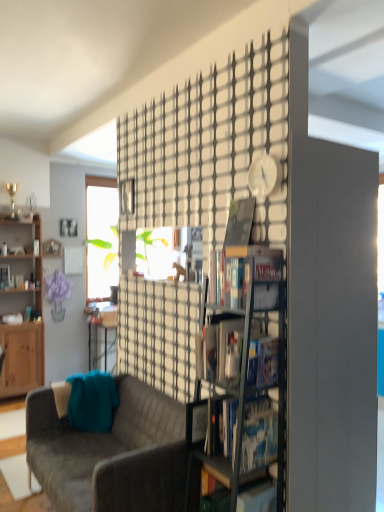
This screenshot has height=512, width=384. Describe the element at coordinates (111, 453) in the screenshot. I see `velvet gray couch at lower left` at that location.

Identify the location of matte black magazine at center. Image resolution: width=384 pixels, height=512 pixels. (192, 251).

This screenshot has width=384, height=512. In order to click on hardcover book at center, the 6th book from the left in this screenshot , I will do [239, 222].

The width and height of the screenshot is (384, 512). Describe the element at coordinates (239, 222) in the screenshot. I see `hardcover book at center, arranged as the first book when viewed from the right` at that location.

Where is `hardcover book at center, placed as the 5th book when sorted from bottom to top`? The width and height of the screenshot is (384, 512). hardcover book at center, placed as the 5th book when sorted from bottom to top is located at coordinates (255, 275).

This screenshot has width=384, height=512. What do you see at coordinates (259, 434) in the screenshot? I see `hardcover book at center, placed as the 4th book when sorted from right to left` at bounding box center [259, 434].

Locate an element on the screen. velvet gray couch at lower left is located at coordinates (111, 453).

From the image's perspective, which one is positioned higher, matte black magazine at center or matte black bookshelf at center, the fourth book from the back?

matte black magazine at center, from the image's perspective.

Which of these two, matte black magazine at center or matte black bookshelf at center, which ranks as the 3th book in bottom-to-top order, is wider?

With larger width is matte black bookshelf at center, which ranks as the 3th book in bottom-to-top order.

How different are the orientations of matte black magazine at center and matte black bookshelf at center, marked as the 3th book in a right-to-left arrangement, in degrees?

matte black magazine at center and matte black bookshelf at center, marked as the 3th book in a right-to-left arrangement, are facing 0.0844 degrees away from each other.

Is matte black bookshelf at center, the fourth book positioned from the top, inside matte black magazine at center?

No, matte black bookshelf at center, the fourth book positioned from the top, is not surrounded by matte black magazine at center.

Could you tell me if wooden bookcase at left is turned towards hardcover book at center, placed as the 2th book when sorted from top to bottom?

Yes.

Considering the sizes of wooden bookcase at left and hardcover book at center, which is the 5th book from left to right, in the image, is wooden bookcase at left bigger or smaller than hardcover book at center, which is the 5th book from left to right,?

Considering their sizes, wooden bookcase at left takes up more space than hardcover book at center, which is the 5th book from left to right.

Which is correct: wooden bookcase at left is inside hardcover book at center, the 4th book when ordered from front to back, or outside of it?

wooden bookcase at left is outside hardcover book at center, the 4th book when ordered from front to back.

From the image's perspective, which one is positioned lower, wooden bookcase at left or hardcover book at center, which is the 5th book from left to right?

wooden bookcase at left, from the image's perspective.

Which of these two, clear glass bookshelf at center or matte black bookshelf at left, acting as the 1th book starting from the left, stands shorter?

Standing shorter between the two is matte black bookshelf at left, acting as the 1th book starting from the left.

Measure the distance between clear glass bookshelf at center and matte black bookshelf at left, the 6th book positioned from the front.

The distance of clear glass bookshelf at center from matte black bookshelf at left, the 6th book positioned from the front, is 3.25 meters.

In the image, is clear glass bookshelf at center positioned in front of or behind matte black bookshelf at left, acting as the 1th book starting from the back?

Clearly, clear glass bookshelf at center is in front of matte black bookshelf at left, acting as the 1th book starting from the back.

Which is behind, point (231, 506) or point (3, 278)?

The point (3, 278) is farther.

In terms of height, does hardcover book at center, placed as the 6th book when sorted from bottom to top, look taller or shorter compared to hardcover book at center, the 3th book viewed from the back?

hardcover book at center, placed as the 6th book when sorted from bottom to top, is taller than hardcover book at center, the 3th book viewed from the back.

I want to click on the 1st book behind when counting from the hardcover book at center, which is the 5th book from left to right, so click(x=239, y=222).

In terms of size, does hardcover book at center, which is the 5th book from front to back, appear bigger or smaller than hardcover book at center, the second book viewed from the right?

Clearly, hardcover book at center, which is the 5th book from front to back, is smaller in size than hardcover book at center, the second book viewed from the right.

Is matte black bookshelf at left, which appears as the 4th book when ordered from the bottom, not close to clear glass bookshelf at center?

Yes, matte black bookshelf at left, which appears as the 4th book when ordered from the bottom, is far from clear glass bookshelf at center.

In the image, is matte black bookshelf at left, the sixth book viewed from the right, positioned in front of or behind clear glass bookshelf at center?

In the image, matte black bookshelf at left, the sixth book viewed from the right, appears behind clear glass bookshelf at center.

Is matte black bookshelf at left, the sixth book viewed from the right, outside of clear glass bookshelf at center?

Absolutely, matte black bookshelf at left, the sixth book viewed from the right, is external to clear glass bookshelf at center.

Does matte black bookshelf at left, the 6th book positioned from the front, appear on the right side of clear glass bookshelf at center?

No, matte black bookshelf at left, the 6th book positioned from the front, is not to the right of clear glass bookshelf at center.

From the image's perspective, which object appears higher, matte black bookshelf at center, positioned as the 4th book in left-to-right order, or hardcover book at center, the 2th book from the back?

hardcover book at center, the 2th book from the back, appears higher in the image.

Between matte black bookshelf at center, acting as the third book starting from the front, and hardcover book at center, which is the 5th book from front to back, which one appears on the right side from the viewer's perspective?

hardcover book at center, which is the 5th book from front to back.

Considering the sizes of objects matte black bookshelf at center, which ranks as the 3th book in bottom-to-top order, and hardcover book at center, placed as the 6th book when sorted from bottom to top, in the image provided, who is bigger, matte black bookshelf at center, which ranks as the 3th book in bottom-to-top order, or hardcover book at center, placed as the 6th book when sorted from bottom to top,?

With larger size is matte black bookshelf at center, which ranks as the 3th book in bottom-to-top order.

From a real-world perspective, which object stands above the other?

From a 3D spatial view, hardcover book at center, the 6th book from the left, is above.

Does clear glass bookshelf at center have a lesser height compared to hardcover book at center, placed as the 5th book when sorted from bottom to top?

Incorrect, the height of clear glass bookshelf at center does not fall short of that of hardcover book at center, placed as the 5th book when sorted from bottom to top.

Where is `shelf below the hardcover book at center, the second book viewed from the right (from a real-world perspective)`? The width and height of the screenshot is (384, 512). shelf below the hardcover book at center, the second book viewed from the right (from a real-world perspective) is located at coordinates (242, 376).

Can hardcover book at center, placed as the 5th book when sorted from bottom to top, be found inside clear glass bookshelf at center?

Yes, hardcover book at center, placed as the 5th book when sorted from bottom to top, is surrounded by clear glass bookshelf at center.

In the scene shown: Which is behind, clear glass bookshelf at center or hardcover book at center, placed as the 5th book when sorted from bottom to top?

hardcover book at center, placed as the 5th book when sorted from bottom to top.

The image size is (384, 512). I want to click on magazine lying behind the matte black bookshelf at center, the fourth book from the back, so click(192, 251).

The image size is (384, 512). Identify the location of book that is the 3rd one when counting upward from the wooden bookcase at left (from the image's perspective). (255, 275).

Based on their spatial positions, is matte black magazine at center or hardcover book at center, the 6th book positioned from the top, further from hardcover book at center, placed as the 5th book when sorted from bottom to top?

hardcover book at center, the 6th book positioned from the top.

When comparing their distances from hardcover book at center, the 2th book from the back, does velvet gray couch at lower left or hardcover book at center, the 4th book when ordered from front to back, seem closer?

hardcover book at center, the 4th book when ordered from front to back, is closer to hardcover book at center, the 2th book from the back.

Looking at the image, which one is located further to matte black magazine at center, hardcover book at center, which is the 5th book from left to right, or matte black bookshelf at left, acting as the 1th book starting from the back?

Among the two, matte black bookshelf at left, acting as the 1th book starting from the back, is located further to matte black magazine at center.

Looking at the image, which one is located further to matte black bookshelf at left, acting as the 1th book starting from the back, matte black bookshelf at center, the fourth book positioned from the top, or hardcover book at center, which is the 5th book from front to back?

matte black bookshelf at center, the fourth book positioned from the top.

Based on their spatial positions, is clear glass bookshelf at center or hardcover book at center, arranged as the first book when viewed from the right, closer to matte black bookshelf at left, acting as the 1th book starting from the left?

Based on the image, hardcover book at center, arranged as the first book when viewed from the right, appears to be nearer to matte black bookshelf at left, acting as the 1th book starting from the left.

Which object lies nearer to the anchor point matte black magazine at center, clear glass bookshelf at center or matte black bookshelf at center, acting as the third book starting from the front?

matte black bookshelf at center, acting as the third book starting from the front, is closer to matte black magazine at center.

Based on the photo, looking at the image, which one is located closer to hardcover book at center, which is the 5th book from left to right, wooden bookcase at left or matte black bookshelf at center, which ranks as the 3th book in bottom-to-top order?

matte black bookshelf at center, which ranks as the 3th book in bottom-to-top order, is positioned closer to the anchor hardcover book at center, which is the 5th book from left to right.

Based on their spatial positions, is hardcover book at center, which is the sixth book in back-to-front order, or velvet gray couch at lower left further from wooden bookcase at left?

The object further to wooden bookcase at left is hardcover book at center, which is the sixth book in back-to-front order.

At what (x,y) coordinates should I click in order to perform the action: click on book between clear glass bookshelf at center and hardcover book at center, which is the sixth book in back-to-front order, from top to bottom. Please return your answer as a coordinate pair (x, y). Looking at the image, I should click on (259, 434).

Locate an element on the screen. This screenshot has height=512, width=384. book between matte black bookshelf at center, the fourth book from the back, and hardcover book at center, the fifth book when ordered from right to left, in the vertical direction is located at coordinates (259, 434).

I want to click on magazine between hardcover book at center, marked as the second book in a bottom-to-top arrangement, and matte black bookshelf at left, the sixth book viewed from the right, along the z-axis, so click(192, 251).

Identify the location of shelf between hardcover book at center, the 6th book from the left, and hardcover book at center, marked as the second book in a bottom-to-top arrangement, from top to bottom. The image size is (384, 512). (242, 376).